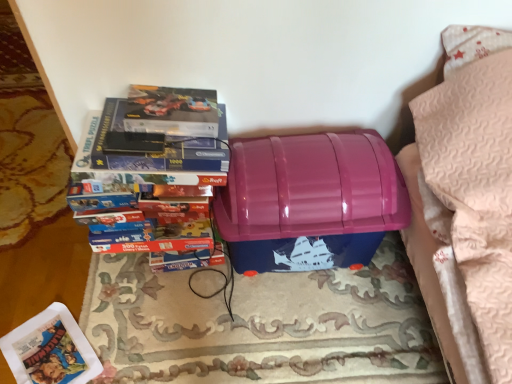
This screenshot has height=384, width=512. In order to click on vacant area that lies to the right of matte plastic paperback book at lower left in this screenshot , I will do `click(137, 335)`.